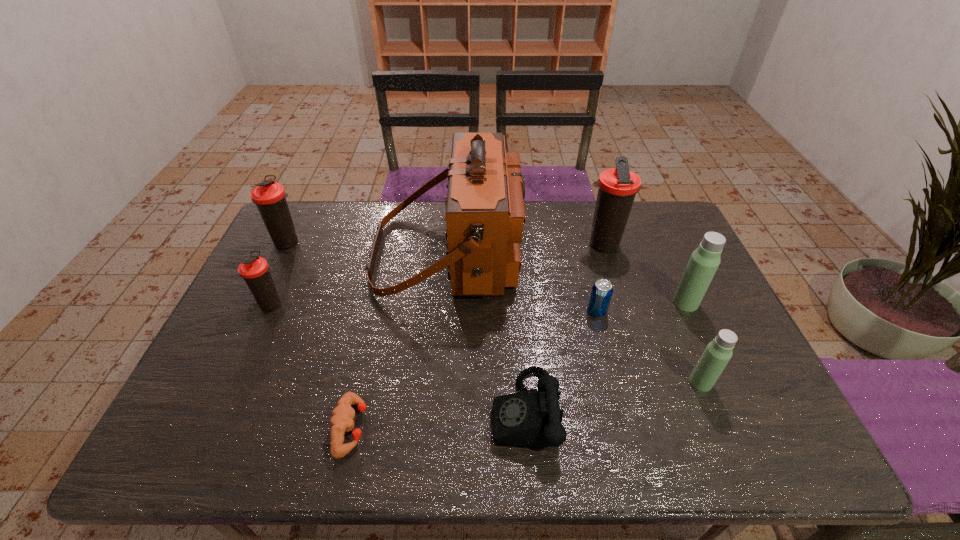
The height and width of the screenshot is (540, 960). In the image, there is a desktop. What are the coordinates of `vacant space at the left edge` in the screenshot? It's located at (269, 342).

Image resolution: width=960 pixels, height=540 pixels. In the image, there is a desktop. Identify the location of blank space at the right edge. (655, 263).

The width and height of the screenshot is (960, 540). What are the coordinates of `free point at the far left corner` in the screenshot? It's located at (291, 217).

The width and height of the screenshot is (960, 540). I want to click on vacant space at the near left corner of the desktop, so click(x=197, y=455).

At what (x,y) coordinates should I click in order to perform the action: click on free space between the satchel and the bigger light thermos bottle. Please return your answer as a coordinate pair (x, y). Looking at the image, I should click on click(x=567, y=279).

Find the location of `unoccupied area between the tallest object and the smallest brown thermos bottle`. unoccupied area between the tallest object and the smallest brown thermos bottle is located at coordinates (360, 279).

The image size is (960, 540). I want to click on unoccupied position between the telephone and the red puncher, so pyautogui.click(x=438, y=420).

Locate an element on the screen. free space between the nearer light thermos bottle and the telephone is located at coordinates click(612, 397).

Find the location of a particular element. free space between the tallest object and the bigger light thermos bottle is located at coordinates (567, 279).

Where is `free space between the nearer light thermos bottle and the telephone`? The height and width of the screenshot is (540, 960). free space between the nearer light thermos bottle and the telephone is located at coordinates (612, 397).